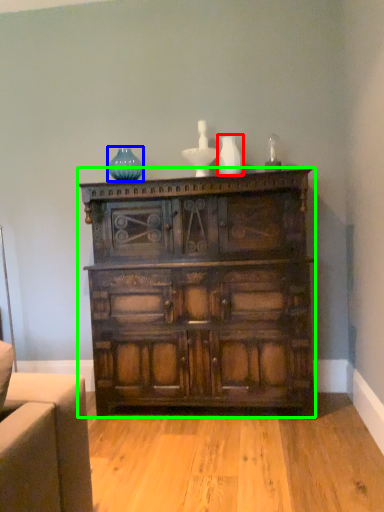
Question: Based on their relative distances, which object is nearer to vase (highlighted by a red box)? Choose from glass vase (highlighted by a blue box) and chest of drawers (highlighted by a green box).

Choices:
 (A) glass vase
 (B) chest of drawers

Answer: (A)